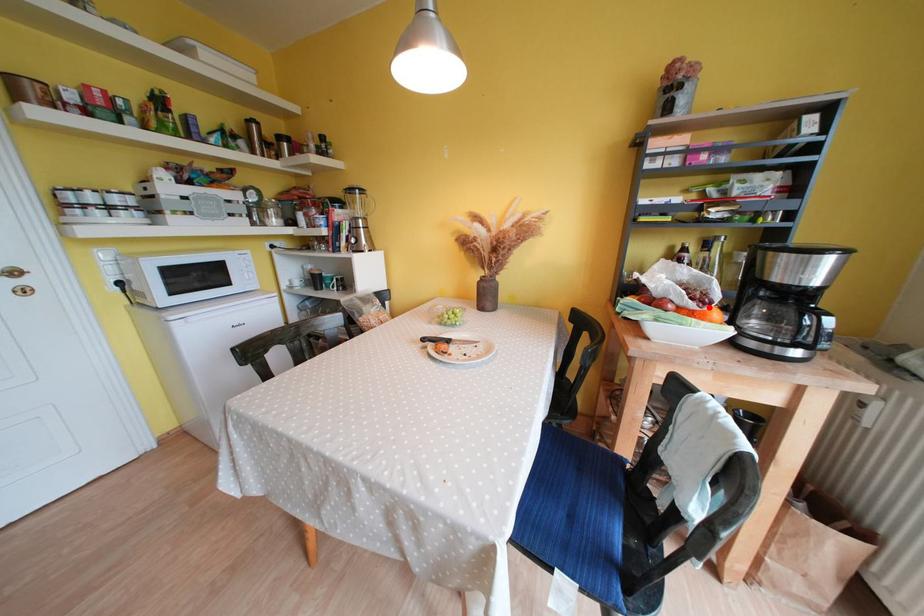
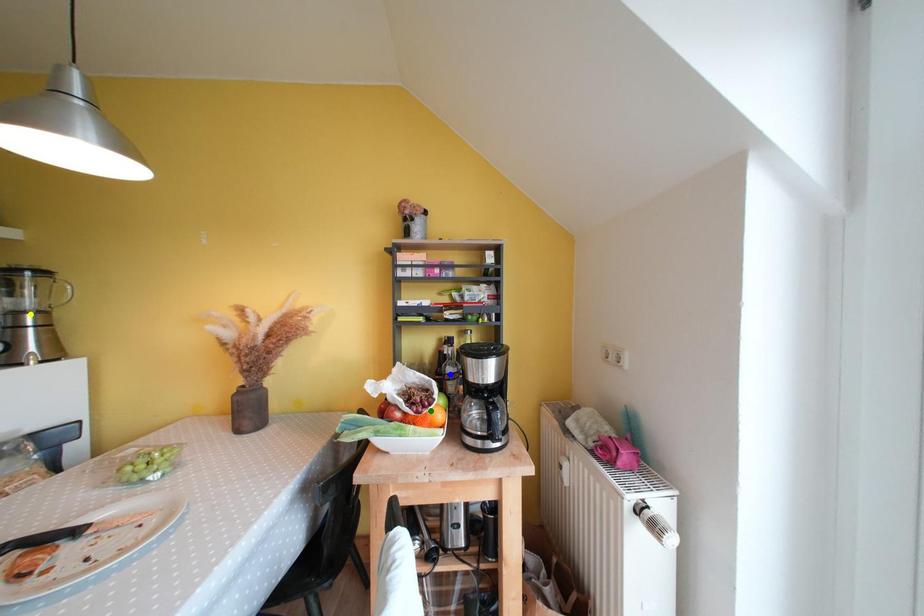
Question: I am providing you with two images of the same scene from different viewpoints. A red point is marked on the first image. You are given multiple points on the second image. In image 2, which mark is for the same physical point as the one in image 1?

Choices:
 (A) green point
 (B) yellow point
 (C) blue point

Answer: (A)